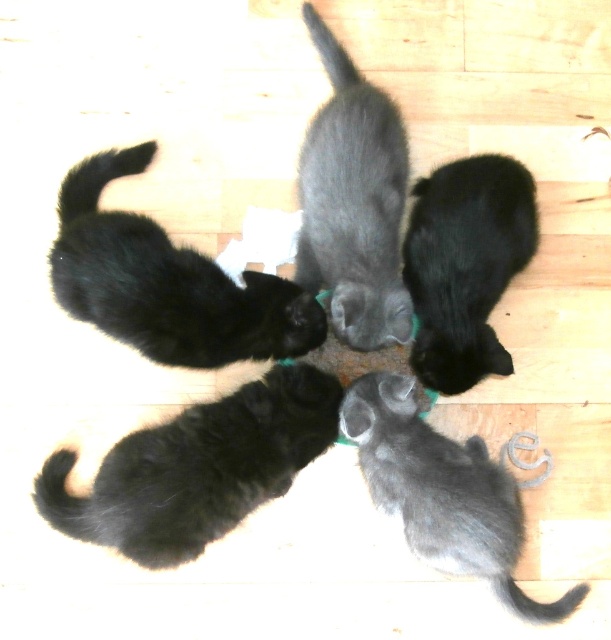
Who is positioned more to the right, black fluffy cat at lower left or gray fluffy cat at center?

gray fluffy cat at center

Is point (210, 403) behind point (321, 262)?

Yes, it is.

The image size is (611, 640). Find the location of `black fluffy cat at lower left`. black fluffy cat at lower left is located at coordinates (196, 468).

Who is positioned more to the left, black soft fur cat at upper left or gray fluffy cat at center?

black soft fur cat at upper left is more to the left.

Between point (244, 348) and point (349, 208), which one is positioned in front?

Point (349, 208) is in front.

Locate an element on the screen. The height and width of the screenshot is (640, 611). black soft fur cat at upper left is located at coordinates (166, 282).

Is gray fluffy cat at center in front of black soft fur kitten at center?

Yes.

Can you confirm if gray fluffy cat at center is positioned to the left of black soft fur kitten at center?

Yes, gray fluffy cat at center is to the left of black soft fur kitten at center.

Does point (375, 120) lie in front of point (505, 362)?

That is False.

The image size is (611, 640). I want to click on gray fluffy cat at center, so click(x=353, y=202).